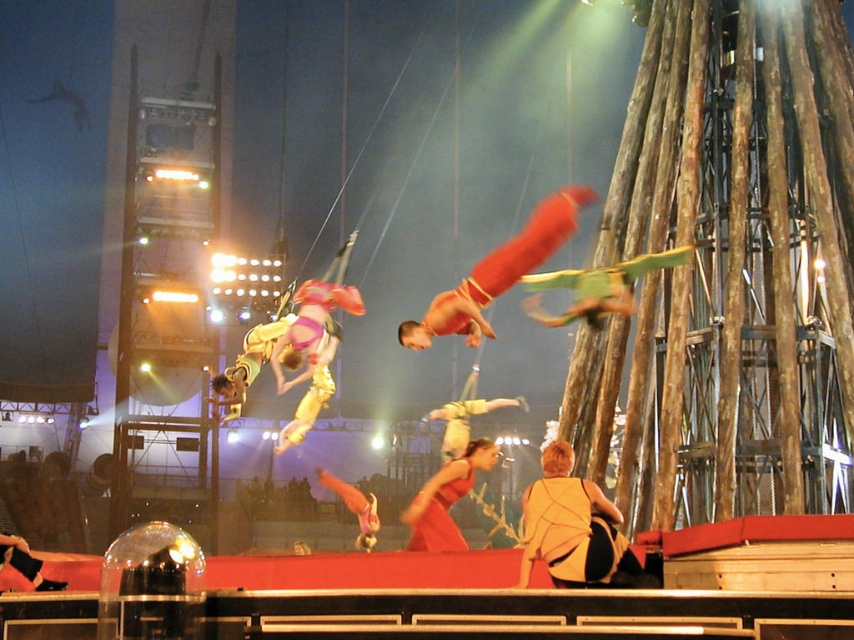
Question: Based on their relative distances, which object is nearer to the yellow fabric acrobat at center?

Choices:
 (A) shiny red fabric at center
 (B) matte red pants at center
 (C) yellow fabric at center

Answer: (A)

Question: Which point is farther to the camera?

Choices:
 (A) (540, 202)
 (B) (607, 516)

Answer: (A)

Question: Can you confirm if matte red pants at center is positioned below shiny red fabric at center?

Choices:
 (A) no
 (B) yes

Answer: (A)

Question: Considering the relative positions of yellow fabric at center and yellow fabric acrobat at center in the image provided, where is yellow fabric at center located with respect to yellow fabric acrobat at center?

Choices:
 (A) left
 (B) right

Answer: (B)

Question: Which of the following is the closest to the observer?

Choices:
 (A) shiny red fabric at center
 (B) yellow fabric acrobat at center
 (C) matte red pants at center
 (D) yellow fabric at center

Answer: (D)

Question: Considering the relative positions of matte red pants at center and yellow fabric acrobat at center in the image provided, where is matte red pants at center located with respect to yellow fabric acrobat at center?

Choices:
 (A) above
 (B) below

Answer: (A)